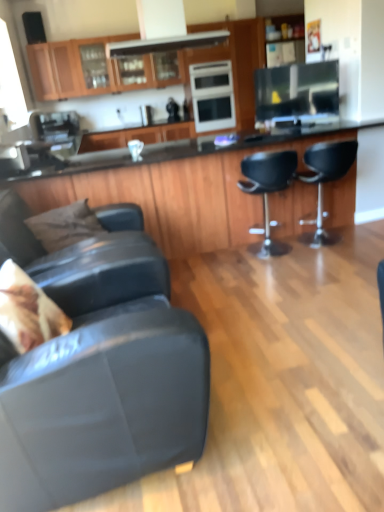
The height and width of the screenshot is (512, 384). Identify the location of vacant space to the right of matte black couch at lower left, acting as the third chair starting from the right. (279, 396).